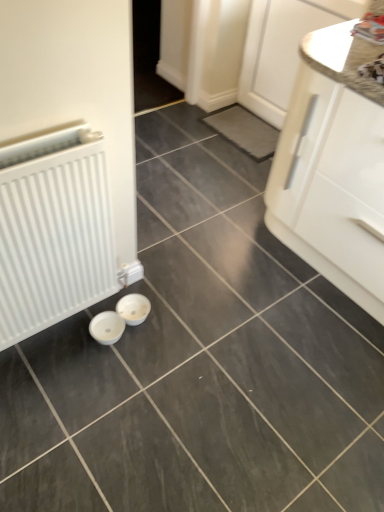
Find the location of a particular element. vacant space in between white matte radiator at left and white glossy cabinet at right, the 1th cabinetry when ordered from bottom to top is located at coordinates (235, 294).